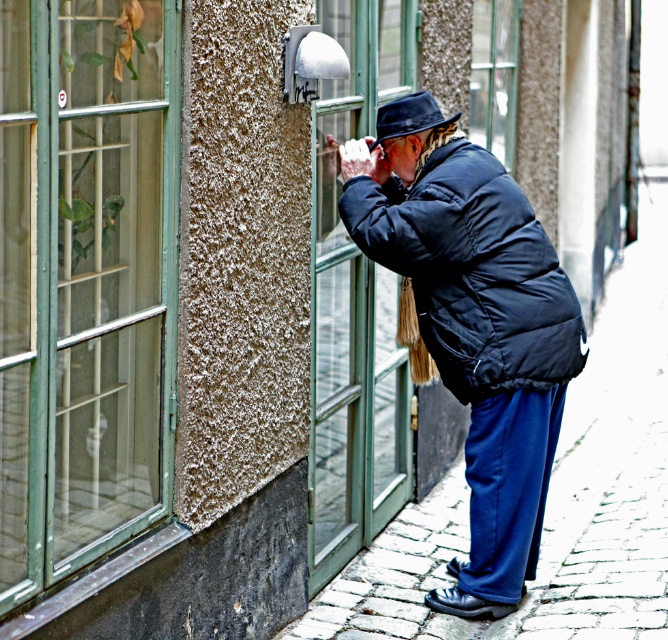
You are a delivery person trying to place a package on the ground near the clear glass window at center and the black felt hat at center. The package requires a minimum of 10 feet of space between it and any objects. Can you place the package between them?

The distance between the clear glass window at center and the black felt hat at center is 10.28 feet, which meets the minimum requirement of 10 feet. Therefore, the package can be placed between them.

You are standing in front of the scene and want to touch the matte black jacket at center and the clear glass window at center. Which object will your hand reach first?

The matte black jacket at center is closer to the viewer than the clear glass window at center, so your hand will reach the matte black jacket at center first.

You are standing in a historic building and see two green glass windows. The first is the green glass window at left, and the second is the green glass window at center. Which window is closer to you?

The green glass window at left is closer to you because it is positioned in front of the green glass window at center.